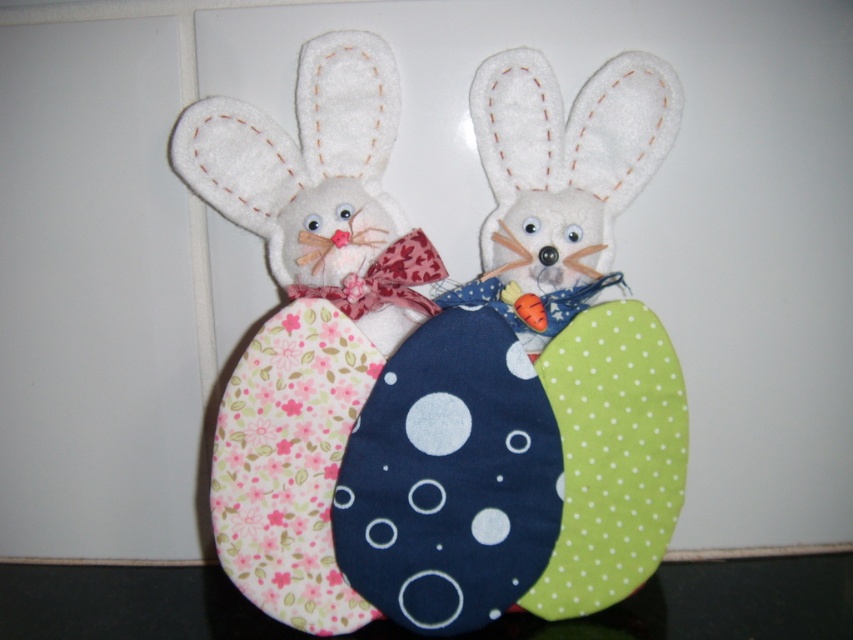
You are organizing a childrens Easter egg hunt and need to place both the fluffy fabric bunny at center and the fluffy white bunny at left into an egg carton. The carton has two compartments with height limits. The left compartment can only accommodate items up to 5 inches tall, while the right compartment allows up to 7 inches. Based on their sizes, which bunny should go where?

The fluffy fabric bunny at center is taller than the fluffy white bunny at left. Therefore, the fluffy fabric bunny at center should be placed in the right compartment of the carton, which allows up to 7 inches, and the fluffy white bunny at left should go into the left compartment, which can hold items up to 5 inches tall.

You are holding a 1.2 meter long pole. If you want to reach the point at coordinates point (439, 356), will your pole be long enough?

The point point (439, 356) is 1.09 meters from the camera. Since the pole is 1.2 meters long, it is longer than the distance needed, so yes, the pole will be long enough to reach the point point (439, 356).